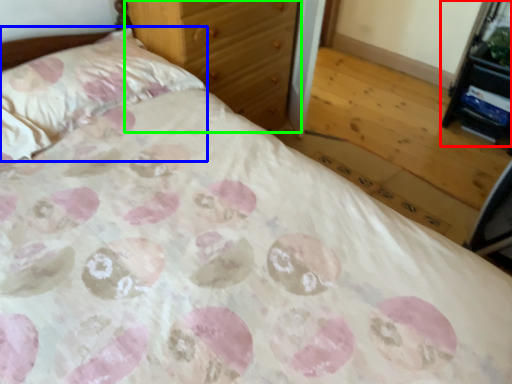
Question: Which object is positioned farthest from vanity (highlighted by a red box)? Select from pillow (highlighted by a blue box) and chest of drawers (highlighted by a green box).

Choices:
 (A) pillow
 (B) chest of drawers

Answer: (A)